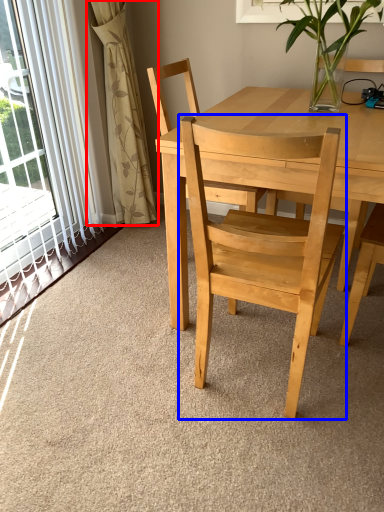
Question: Which point is further to the camera, curtain (highlighted by a red box) or chair (highlighted by a blue box)?

Choices:
 (A) curtain
 (B) chair

Answer: (A)